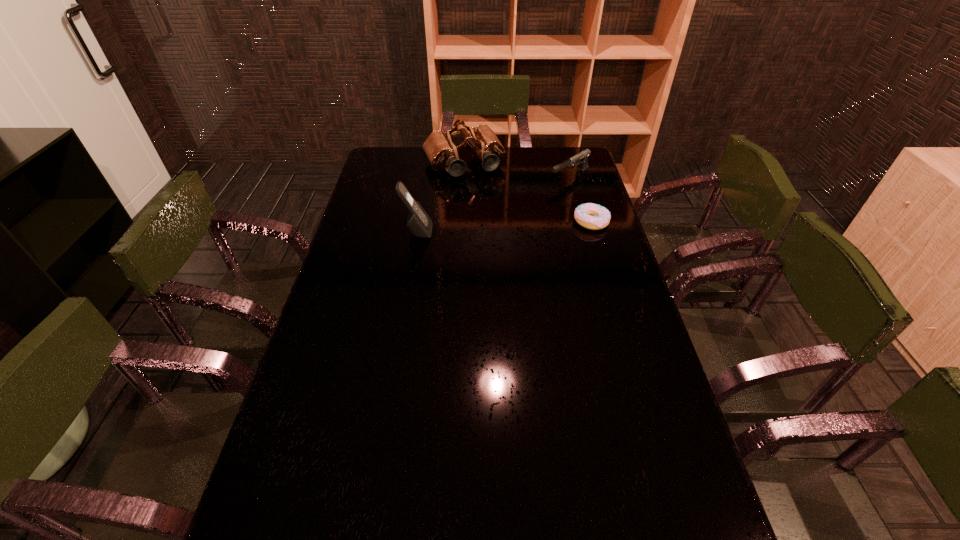
I want to click on vacant area at the far left corner of the desktop, so pos(407,166).

Where is `free space between the binoculars and the doughnut`? This screenshot has width=960, height=540. free space between the binoculars and the doughnut is located at coordinates (528, 193).

The width and height of the screenshot is (960, 540). In order to click on empty space between the third tallest object and the third shortest object in this screenshot , I will do `click(516, 171)`.

Identify the location of vacant space that is in between the cellular telephone and the shortest object. (504, 227).

Locate an element on the screen. empty space between the binoculars and the doughnut is located at coordinates (528, 193).

Where is `empty space between the gun and the doughnut`? The image size is (960, 540). empty space between the gun and the doughnut is located at coordinates pyautogui.click(x=581, y=199).

You are a GUI agent. You are given a task and a screenshot of the screen. Output one action in this format:
    pyautogui.click(x=<x>, y=<y>)
    Task: Click on the vacant space that is in between the tallest object and the gun
    The height and width of the screenshot is (540, 960).
    Given the screenshot: What is the action you would take?
    pyautogui.click(x=493, y=204)

Identify the location of vacant area that lies between the cellular telephone and the doughnut. (504, 227).

Locate an element on the screen. This screenshot has width=960, height=540. vacant point located between the second shortest object and the cellular telephone is located at coordinates (493, 204).

Where is `vacant area between the cellular telephone and the second shortest object`? The image size is (960, 540). vacant area between the cellular telephone and the second shortest object is located at coordinates tap(493, 204).